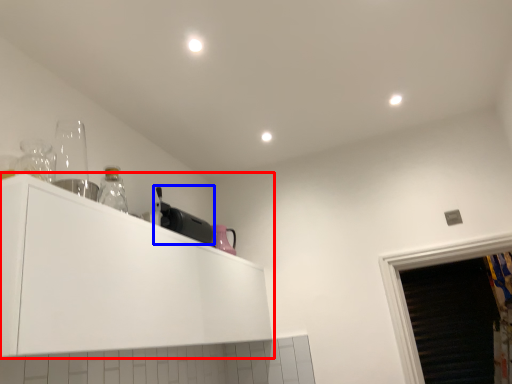
Question: Which of the following is the farthest to the observer, cabinetry (highlighted by a red box) or appliance (highlighted by a blue box)?

Choices:
 (A) cabinetry
 (B) appliance

Answer: (B)